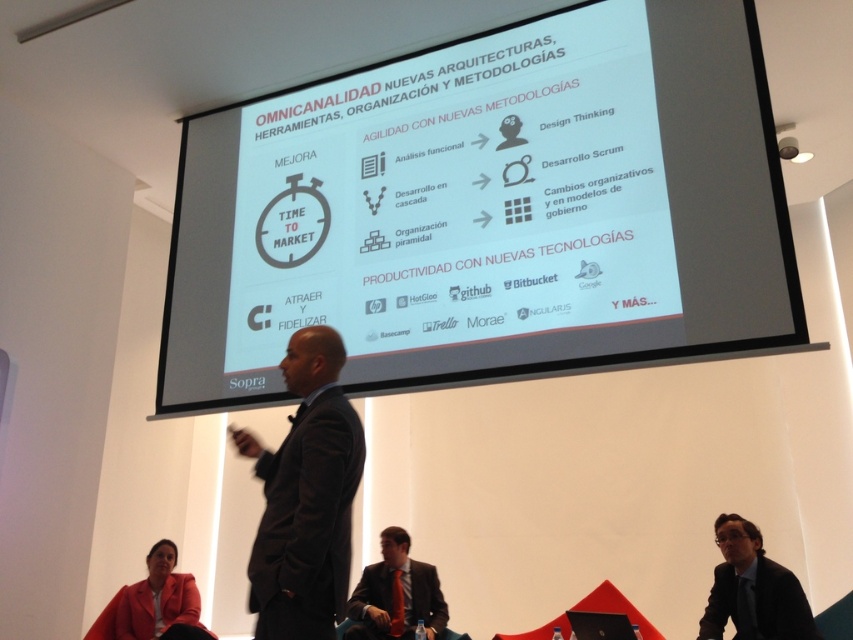
Question: Can you confirm if white matte projection screen at center is wider than matte red blazer at lower left?

Choices:
 (A) no
 (B) yes

Answer: (B)

Question: Which object is positioned farthest from the white matte projection screen at center?

Choices:
 (A) black fabric business suit at lower right
 (B) matte red blazer at lower left

Answer: (A)

Question: Which object is farther from the camera taking this photo?

Choices:
 (A) matte black suit at lower center
 (B) white matte projection screen at center

Answer: (A)

Question: Which of the following is the closest to the observer?

Choices:
 (A) black fabric business suit at lower right
 (B) matte red blazer at lower left
 (C) matte black suit at lower center
 (D) dark suit at center

Answer: (D)

Question: Is dark suit at center positioned before black fabric business suit at lower right?

Choices:
 (A) yes
 (B) no

Answer: (A)

Question: Is white matte projection screen at center thinner than matte black suit at lower center?

Choices:
 (A) no
 (B) yes

Answer: (A)